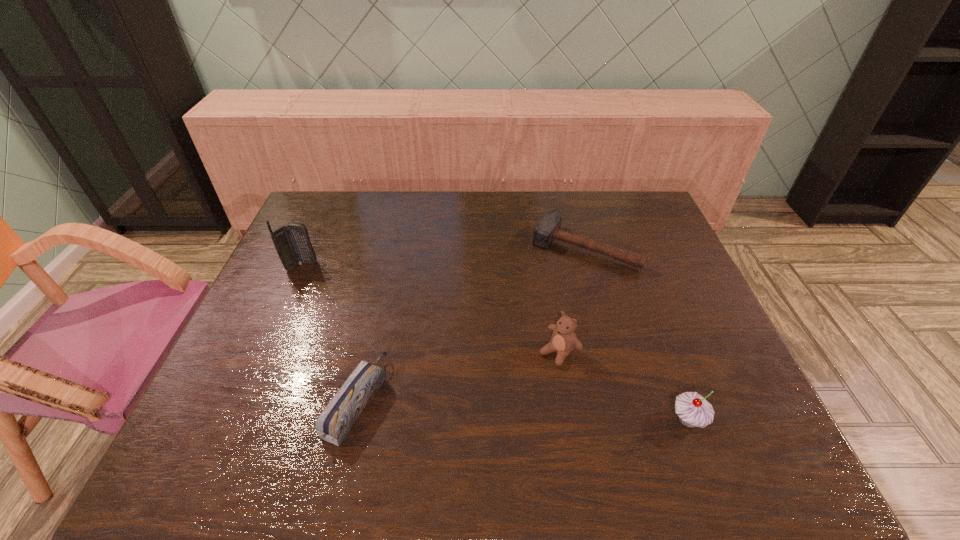
In the image, there is a desktop. Identify the location of free space at the far right corner. (642, 192).

The height and width of the screenshot is (540, 960). In order to click on free point between the tallest object and the cupcake in this screenshot , I will do `click(494, 343)`.

At what (x,y) coordinates should I click in order to perform the action: click on blank region between the teddy bear and the shortest object. Please return your answer as a coordinate pair (x, y). Image resolution: width=960 pixels, height=540 pixels. Looking at the image, I should click on (572, 300).

The height and width of the screenshot is (540, 960). I want to click on free area in between the cupcake and the teddy bear, so click(623, 386).

Find the location of a particular element. free space between the teddy bear and the pencil box is located at coordinates (458, 376).

In order to click on free space that is in between the hammer and the second object from left to right in this screenshot , I will do `click(470, 323)`.

The image size is (960, 540). Identify the location of unoccupied position between the fourth object from right to left and the teddy bear. (458, 376).

Locate an element on the screen. This screenshot has height=540, width=960. vacant region between the cupcake and the shortest object is located at coordinates (636, 334).

This screenshot has width=960, height=540. What are the coordinates of `free space between the hammer and the cupcake` in the screenshot? It's located at (636, 334).

Where is `vacant region between the tallest object and the pencil box`? The width and height of the screenshot is (960, 540). vacant region between the tallest object and the pencil box is located at coordinates (329, 333).